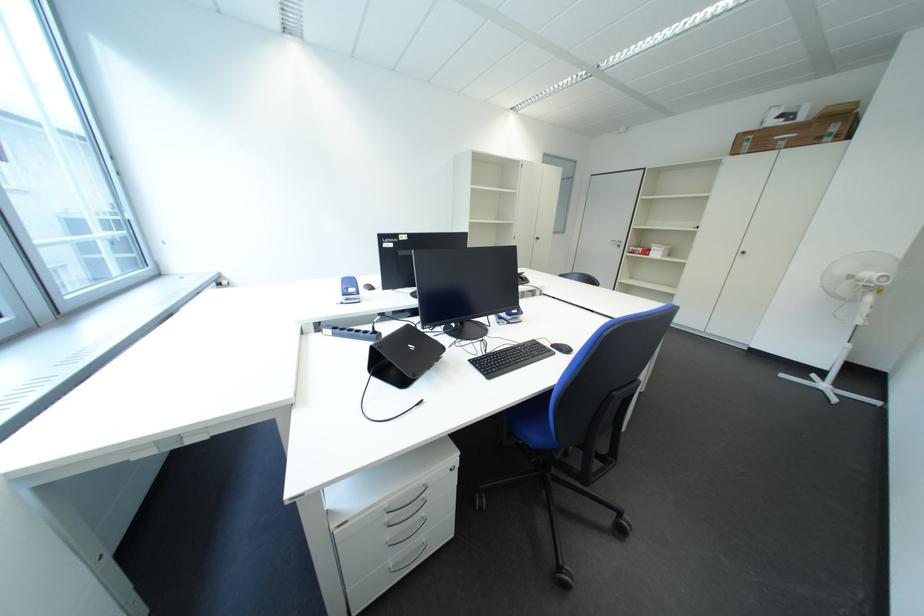
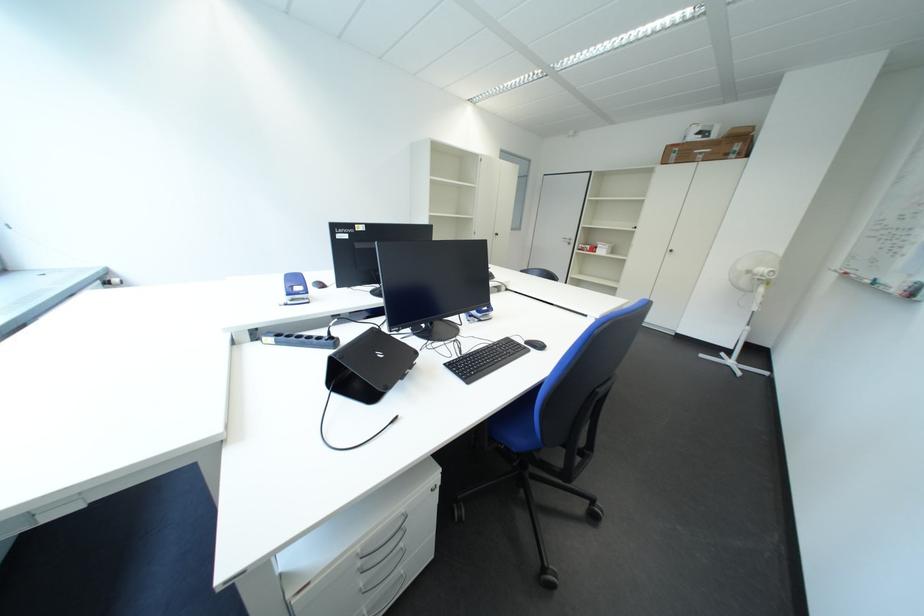
Find the pixel in the second image that matches [846,131] in the first image.

(748, 150)